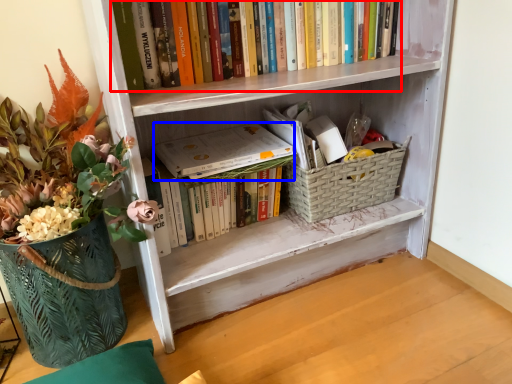
Question: Among these objects, which one is nearest to the camera, book (highlighted by a red box) or paperback book (highlighted by a blue box)?

Choices:
 (A) book
 (B) paperback book

Answer: (A)